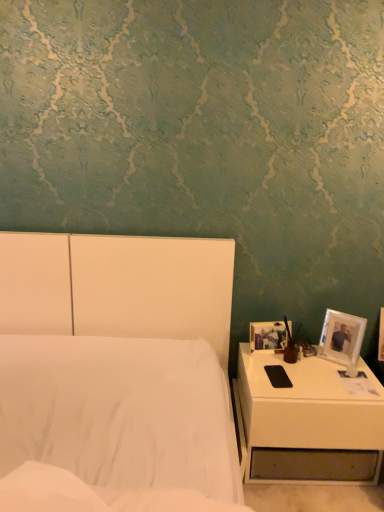
Question: Does white glossy nightstand at lower right come behind matte brown vase at right?

Choices:
 (A) no
 (B) yes

Answer: (A)

Question: Considering the relative sizes of white glossy nightstand at lower right and matte brown vase at right in the image provided, is white glossy nightstand at lower right thinner than matte brown vase at right?

Choices:
 (A) no
 (B) yes

Answer: (A)

Question: Would you say white glossy nightstand at lower right contains matte brown vase at right?

Choices:
 (A) no
 (B) yes

Answer: (A)

Question: Considering the relative positions of white glossy nightstand at lower right and matte brown vase at right in the image provided, is white glossy nightstand at lower right in front of matte brown vase at right?

Choices:
 (A) no
 (B) yes

Answer: (B)

Question: Is white glossy nightstand at lower right at the right side of matte brown vase at right?

Choices:
 (A) no
 (B) yes

Answer: (B)

Question: From a real-world perspective, is matte brown vase at right physically located above or below white plastic picture frame at right, which is the second picture frame from left to right?

Choices:
 (A) below
 (B) above

Answer: (B)

Question: Considering the positions of matte brown vase at right and white plastic picture frame at right, which is the second picture frame from left to right, in the image, is matte brown vase at right taller or shorter than white plastic picture frame at right, which is the second picture frame from left to right,?

Choices:
 (A) short
 (B) tall

Answer: (A)

Question: Which is correct: matte brown vase at right is inside white plastic picture frame at right, the first picture frame from the right, or outside of it?

Choices:
 (A) inside
 (B) outside

Answer: (B)

Question: Considering the relative positions of matte brown vase at right and white plastic picture frame at right, the first picture frame from the right, in the image provided, is matte brown vase at right to the left or to the right of white plastic picture frame at right, the first picture frame from the right,?

Choices:
 (A) right
 (B) left

Answer: (B)

Question: In the image, is white plastic picture frame at right, which is the second picture frame from left to right, positioned in front of or behind white matte bed at center?

Choices:
 (A) front
 (B) behind

Answer: (B)

Question: From a real-world perspective, is white plastic picture frame at right, the first picture frame from the right, positioned above or below white matte bed at center?

Choices:
 (A) above
 (B) below

Answer: (A)

Question: Visually, is white plastic picture frame at right, which is the second picture frame from left to right, positioned to the left or to the right of white matte bed at center?

Choices:
 (A) right
 (B) left

Answer: (A)

Question: Is white plastic picture frame at right, which is the second picture frame from left to right, inside or outside of white matte bed at center?

Choices:
 (A) outside
 (B) inside

Answer: (A)

Question: From a real-world perspective, is white glossy nightstand at lower right positioned above or below matte brown vase at right?

Choices:
 (A) above
 (B) below

Answer: (B)

Question: Relative to matte brown vase at right, is white glossy nightstand at lower right in front or behind?

Choices:
 (A) front
 (B) behind

Answer: (A)